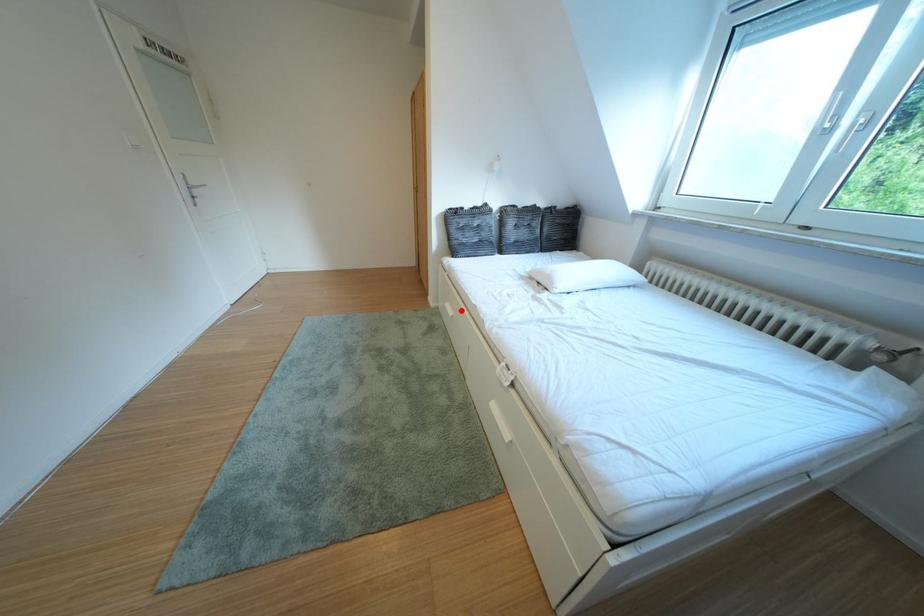
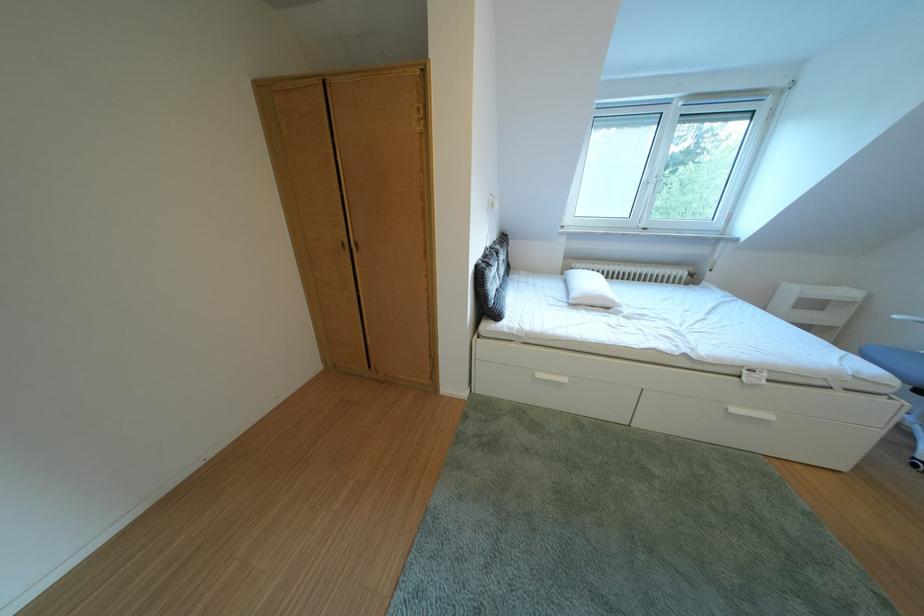
Find the pixel in the second image that matches the highlighted location in the first image.

(553, 381)